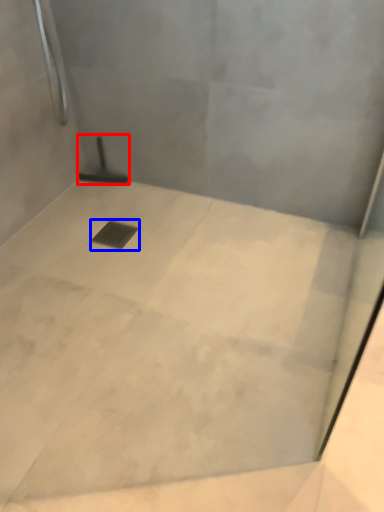
Question: Which object appears farthest to the camera in this image, shower (highlighted by a red box) or drain (highlighted by a blue box)?

Choices:
 (A) shower
 (B) drain

Answer: (A)